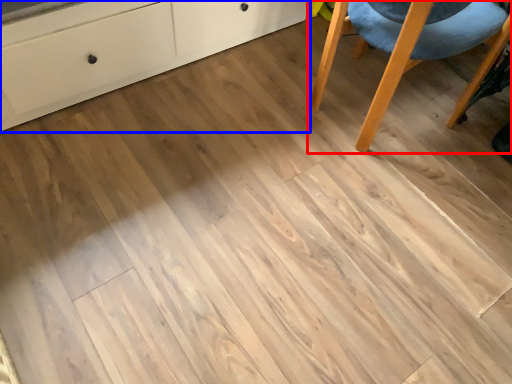
Question: Which object appears farthest to the camera in this image, chair (highlighted by a red box) or chest of drawers (highlighted by a blue box)?

Choices:
 (A) chair
 (B) chest of drawers

Answer: (A)